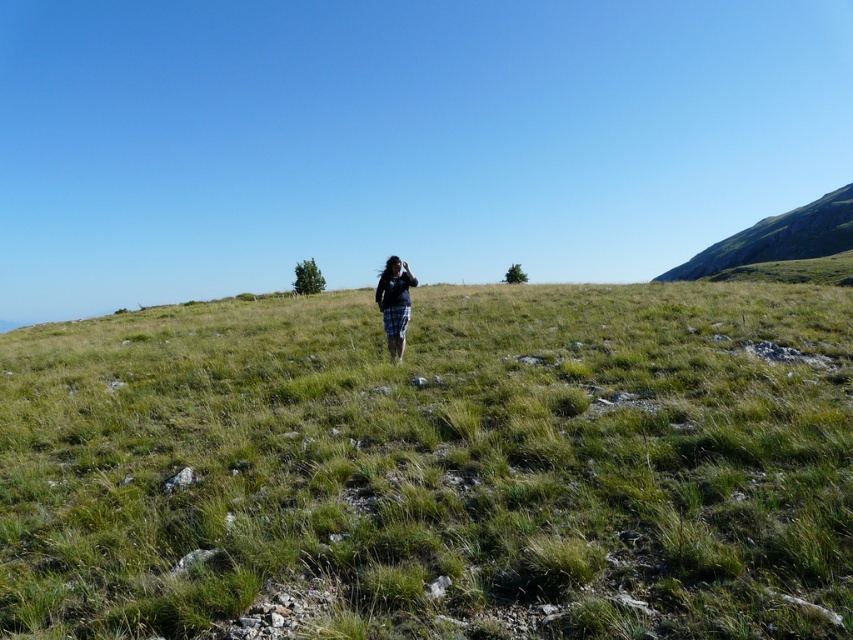
Question: Which of the following is the closest to the observer?

Choices:
 (A) (413, 612)
 (B) (393, 324)
 (C) (720, 244)

Answer: (A)

Question: Does green grassy at center appear over green grassy hillside at upper right?

Choices:
 (A) yes
 (B) no

Answer: (B)

Question: From the image, what is the correct spatial relationship of green grassy at center in relation to green grassy hillside at upper right?

Choices:
 (A) right
 (B) left

Answer: (B)

Question: Which point is farther from the camera taking this photo?

Choices:
 (A) (397, 353)
 (B) (786, 589)
 (C) (793, 240)

Answer: (C)

Question: Which of the following is the farthest from the observer?

Choices:
 (A) (809, 220)
 (B) (402, 349)
 (C) (427, 326)

Answer: (A)

Question: Does green grassy at center lie behind green grassy hillside at upper right?

Choices:
 (A) no
 (B) yes

Answer: (A)